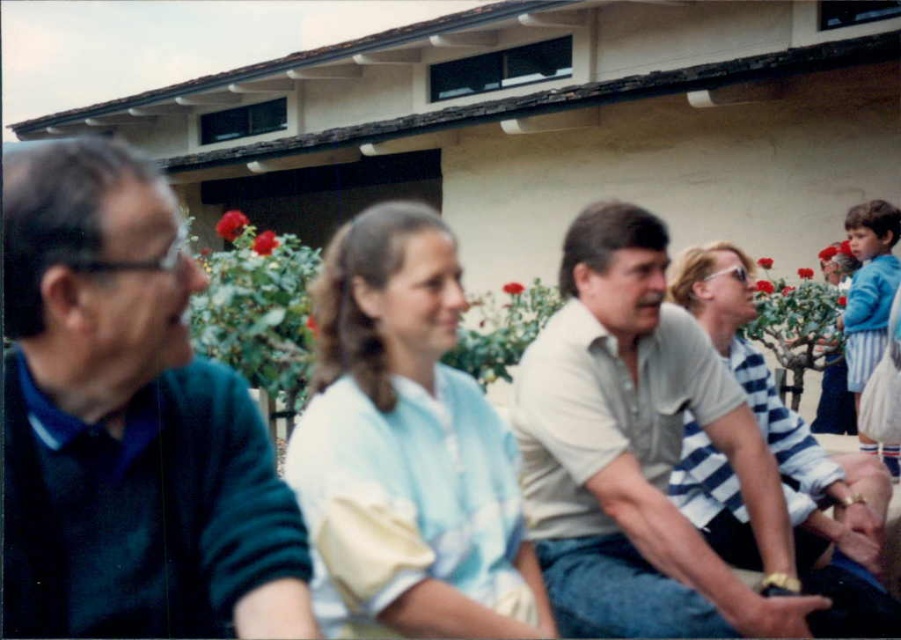
Question: Which object is farther from the camera taking this photo?

Choices:
 (A) light blue fabric shirt at center
 (B) white striped shirt at right
 (C) light beige shirt at center
 (D) dark blue sweater at left

Answer: (B)

Question: Can you confirm if dark blue sweater at left is positioned below white striped shirt at right?

Choices:
 (A) yes
 (B) no

Answer: (B)

Question: Among these objects, which one is nearest to the camera?

Choices:
 (A) dark blue sweater at left
 (B) white striped shirt at right
 (C) light blue fabric shirt at center

Answer: (A)

Question: Is dark blue sweater at left positioned at the back of light blue fabric shirt at center?

Choices:
 (A) yes
 (B) no

Answer: (B)

Question: Which object is the closest to the light blue fabric shirt at center?

Choices:
 (A) dark blue sweater at left
 (B) white striped shirt at right
 (C) light beige shirt at center

Answer: (A)

Question: Is dark blue sweater at left positioned at the back of light beige shirt at center?

Choices:
 (A) yes
 (B) no

Answer: (B)